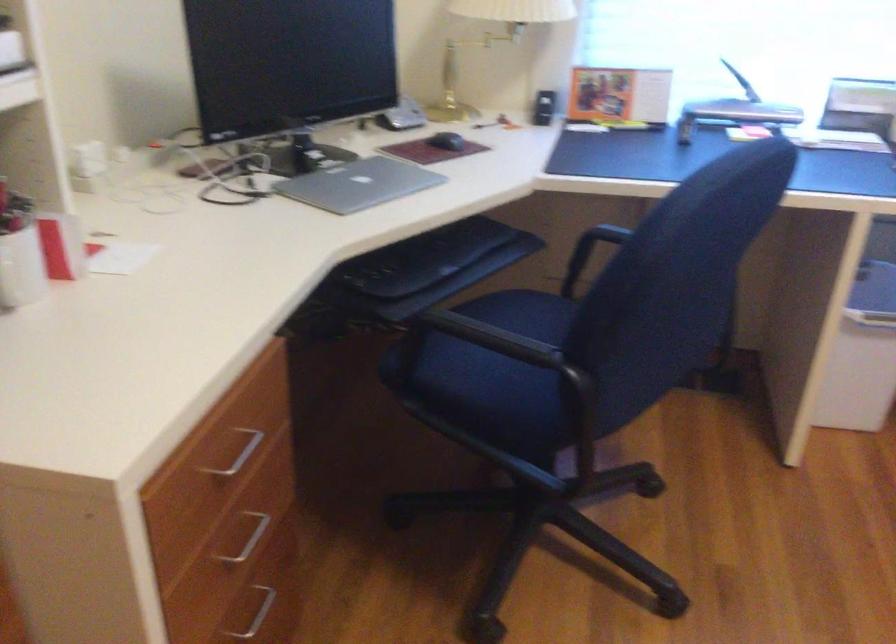
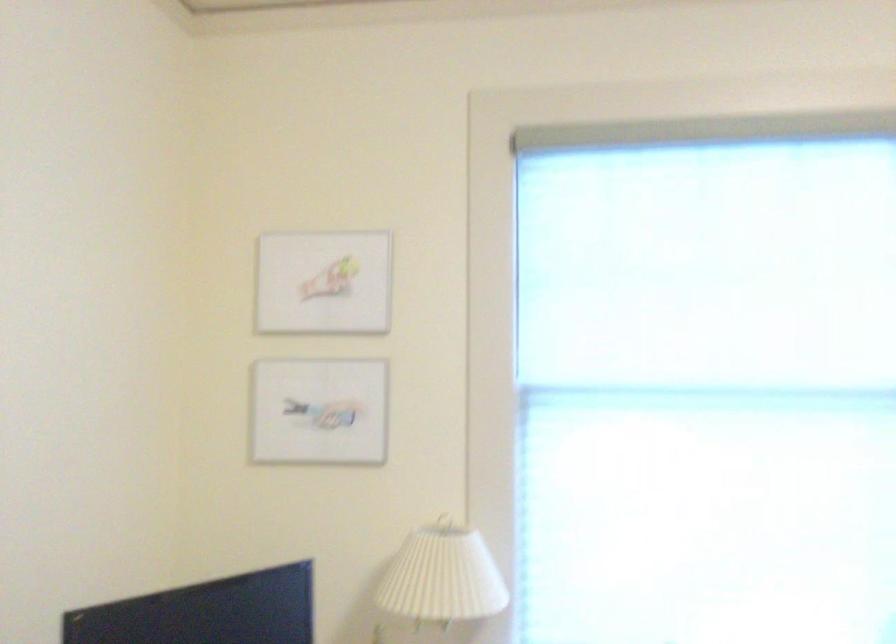
Question: The first image is from the beginning of the video and the second image is from the end. How did the camera likely rotate when shooting the video?

Choices:
 (A) Left
 (B) Right
 (C) Up
 (D) Down

Answer: (C)